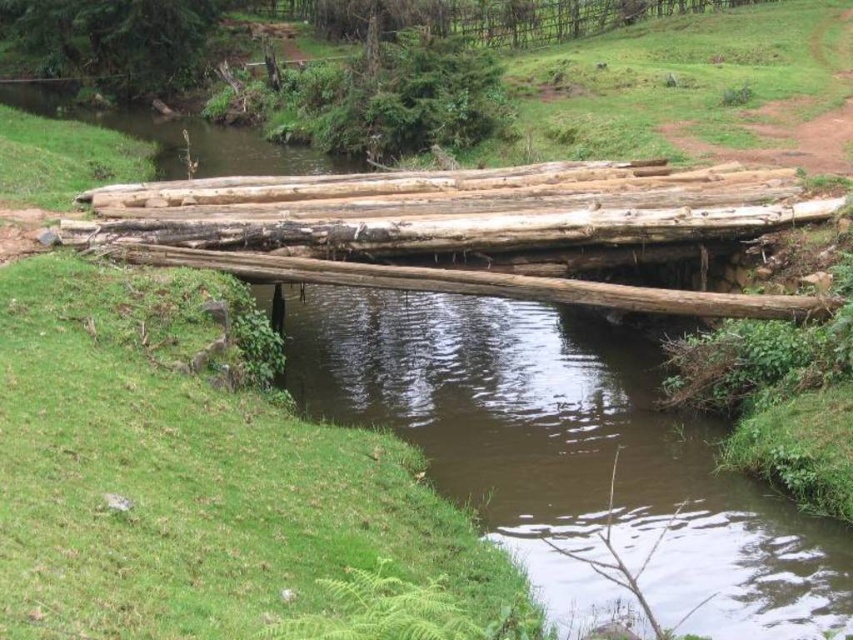
You are standing on the rustic wooden bridge and want to locate the brown wood stream at center. According to the coordinates provided, where exactly would you find it?

The brown wood stream at center is located at coordinates point (570, 456).

You are standing on the rustic wooden bridge and want to cross to the other side. The bridge is made of two types of wood structures. Which of the two, the brown wood stream at center or the natural wood logs at center, is narrower in width?

The brown wood stream at center is thinner than natural wood logs at center, so the brown wood stream at center is narrower in width.

You are standing at the edge of the brown wood stream at center and want to cross to the opposite bank. The bridge is 10 meters long. Can you safely walk across the bridge to reach the other side?

The distance between you and the camera is 10.78 meters, but the bridge is only 10 meters long. Therefore, the bridge is too short to span the stream, making it unsafe to cross.